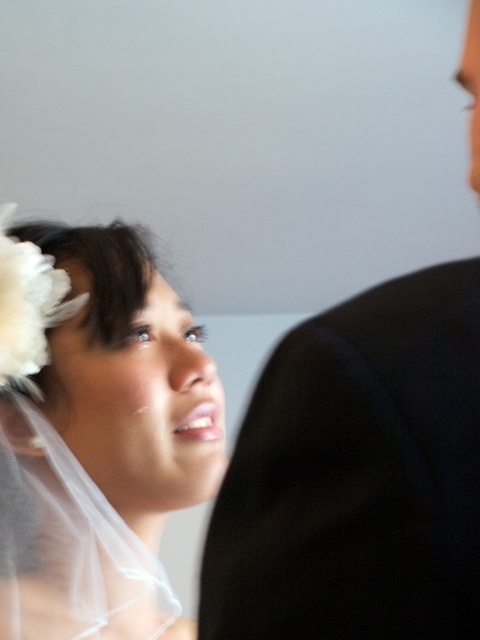
Is point (437, 570) closer to viewer compared to point (116, 301)?

Yes, it is in front of point (116, 301).

Consider the image. Is black fabric at right to the left of white sheer veil at upper left from the viewer's perspective?

No, black fabric at right is not to the left of white sheer veil at upper left.

Is point (428, 496) closer to viewer compared to point (47, 422)?

Yes, it is in front of point (47, 422).

Image resolution: width=480 pixels, height=640 pixels. Identify the location of black fabric at right. (358, 476).

Can you confirm if black fabric at right is positioned to the right of white feather at upper left?

Indeed, black fabric at right is positioned on the right side of white feather at upper left.

Measure the distance between point [451,448] and camera.

Point [451,448] is 9.54 inches away from camera.

Where is `black fabric at right`? black fabric at right is located at coordinates (358, 476).

Is white sheer veil at upper left to the left of white feather at upper left from the viewer's perspective?

In fact, white sheer veil at upper left is to the right of white feather at upper left.

Locate an element on the screen. Image resolution: width=480 pixels, height=640 pixels. white sheer veil at upper left is located at coordinates (96, 433).

Between point (69, 442) and point (34, 268), which one is positioned in front?

Positioned in front is point (34, 268).

I want to click on white sheer veil at upper left, so click(x=96, y=433).